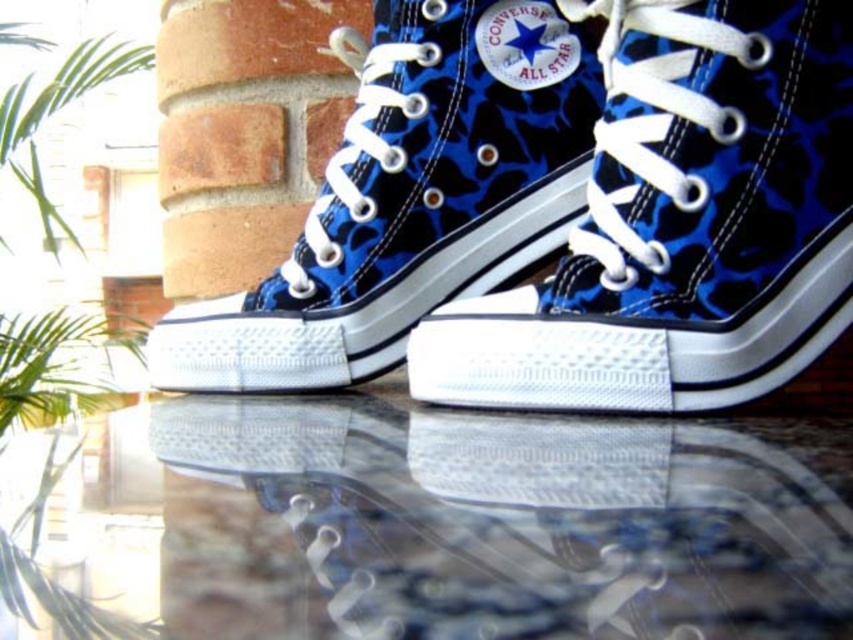
In the scene shown: You are a photographer setting up a shoot. You need to position a light source so that it illuminates the transparent glass table at center without casting a shadow from the blue canvas converse all star at center. Is this possible based on the scene description?

The transparent glass table at center is in front of the blue canvas converse all star at center, so placing the light source behind the shoes would allow light to pass through the table without casting a shadow from the shoes onto the table.

You are a photographer trying to capture the Converse All Star sneakers in the image. You want to focus on the point closer to the camera between the two points labeled point (573, 554) and point (425, 243). Which point should you aim your camera at?

You should aim your camera at point (573, 554) because it is closer to the camera than point (425, 243).

You are trying to place a pair of blue camouflage fabric converse all star at center on a transparent glass table at center. However, you notice that the glass table might not be tall enough to support the shoes properly. Based on the scene description, can the glass table at center hold the converse all star at center without the shoes toppling over?

The transparent glass table at center is shorter than blue camouflage fabric converse all star at center, so the table might not provide enough stability to prevent the shoes from toppling over due to its insufficient height.